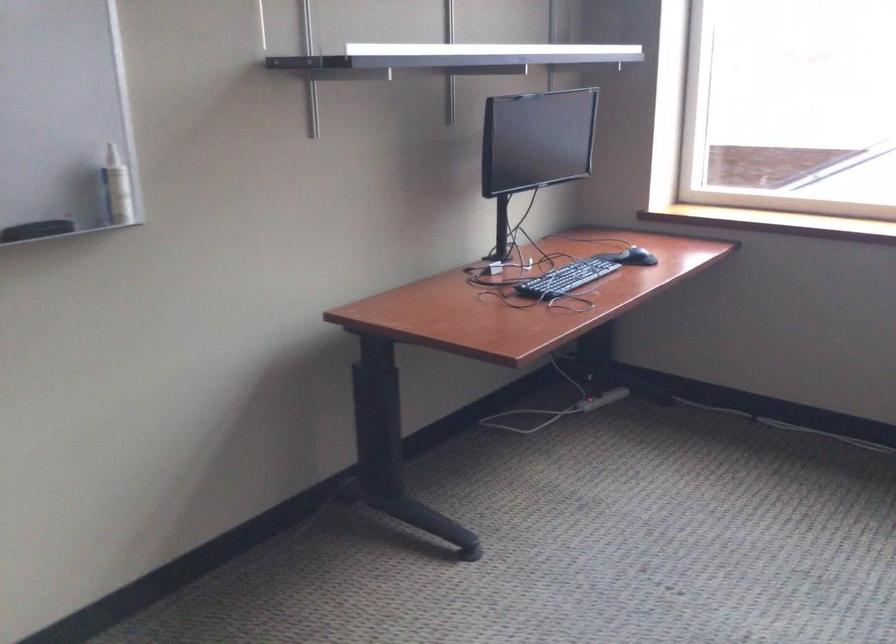
Where would you click the computer mouse? Please return your answer as a coordinate pair (x, y).

(636, 257)